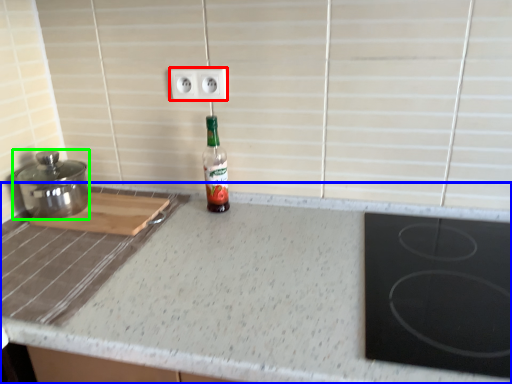
Question: Which is nearer to the electric outlet (highlighted by a red box)? countertop (highlighted by a blue box) or kitchen appliance (highlighted by a green box).

Choices:
 (A) countertop
 (B) kitchen appliance

Answer: (B)